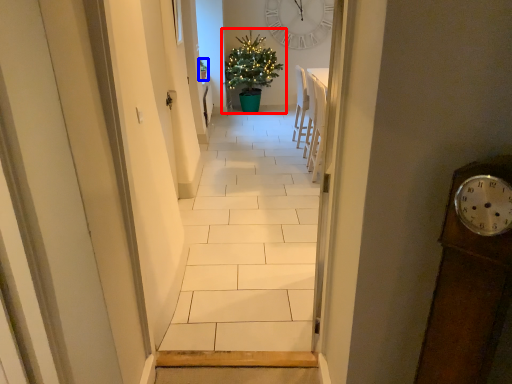
Question: Which of the following is the farthest to the observer, christmas tree (highlighted by a red box) or houseplant (highlighted by a blue box)?

Choices:
 (A) christmas tree
 (B) houseplant

Answer: (B)